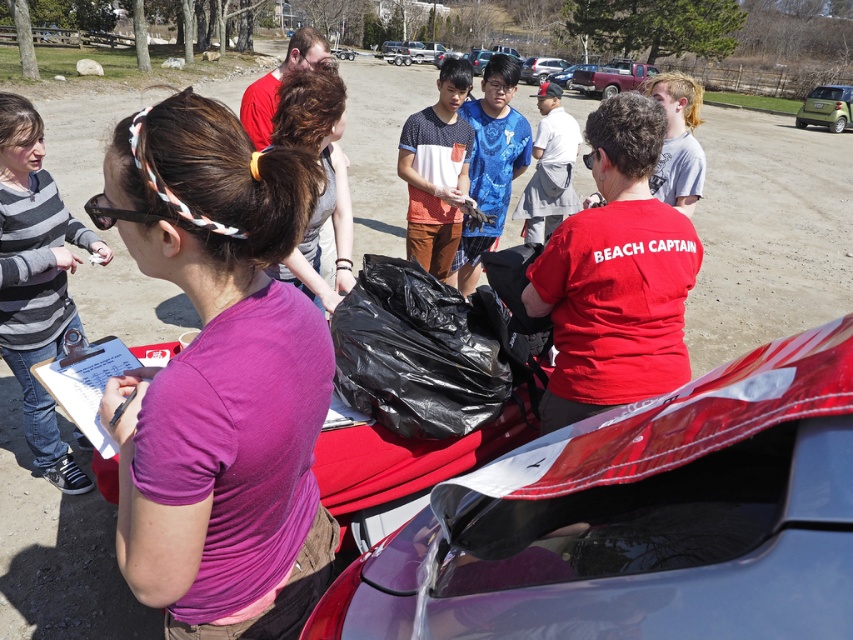
Is glossy plastic car at center thinner than red matte shirt at center?

Incorrect, glossy plastic car at center's width is not less than red matte shirt at center's.

Is point (343, 625) less distant than point (560, 372)?

Yes, point (343, 625) is closer to viewer.

At what (x,y) coordinates should I click in order to perform the action: click on glossy plastic car at center. Please return your answer as a coordinate pair (x, y). The width and height of the screenshot is (853, 640). Looking at the image, I should click on (640, 518).

Consider the image. Is red matte shirt at center above metallic silver car at center?

Incorrect, red matte shirt at center is not positioned above metallic silver car at center.

Between point (572, 243) and point (538, 67), which one is positioned in front?

Point (572, 243) is more forward.

Is point (601, 118) positioned in front of point (547, 65)?

Yes.

This screenshot has height=640, width=853. Identify the location of red matte shirt at center. (614, 275).

Between brown hair at upper center and green matte car at upper right, which one is positioned higher?

green matte car at upper right

Who is more forward, (340, 236) or (817, 109)?

Positioned in front is point (340, 236).

Between point (326, 296) and point (801, 109), which one is positioned in front?

Point (326, 296) is in front.

At what (x,y) coordinates should I click in order to perform the action: click on brown hair at upper center. Please return your answer as a coordinate pair (x, y). Looking at the image, I should click on (323, 173).